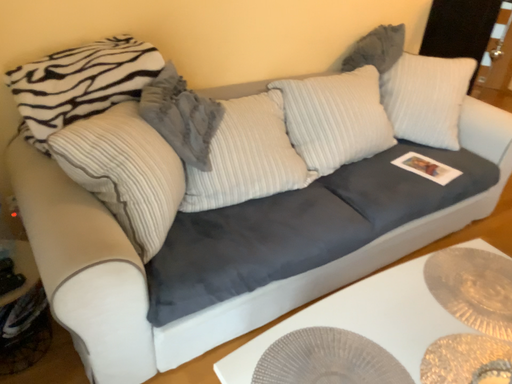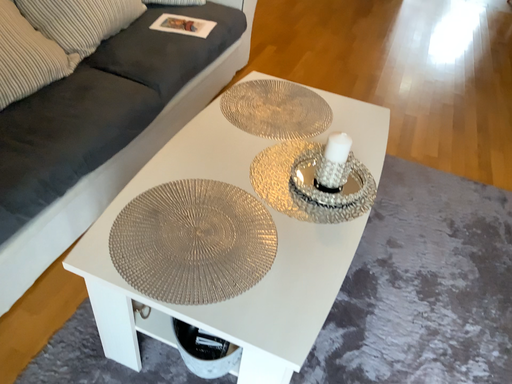
Question: Which way did the camera rotate in the video?

Choices:
 (A) rotated right
 (B) rotated left

Answer: (A)